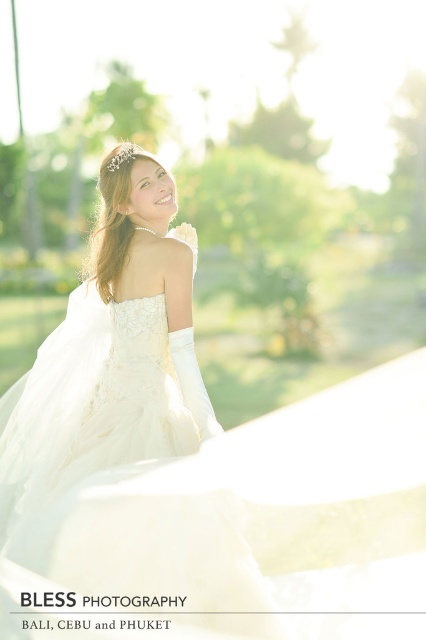
Based on the scene description, where is the ivory satin dress at center located in terms of coordinates?

The ivory satin dress at center is located at coordinates point (112, 355).

Looking at the bride in the ivory satin dress at center and the silver metallic tiara at upper center, which object is positioned to the right?

The silver metallic tiara at upper center is positioned to the right of the ivory satin dress at center.

You are a photographer preparing to capture the bride in the image. You need to ensure that both the ivory satin dress at center and the silver metallic tiara at upper center are clearly visible in the frame. Based on their sizes, which object should you focus on first to ensure proper framing?

The ivory satin dress at center is larger in width than the silver metallic tiara at upper center, so you should focus on framing the ivory satin dress at center first to ensure it fits well within the shot before adjusting for the smaller tiara.